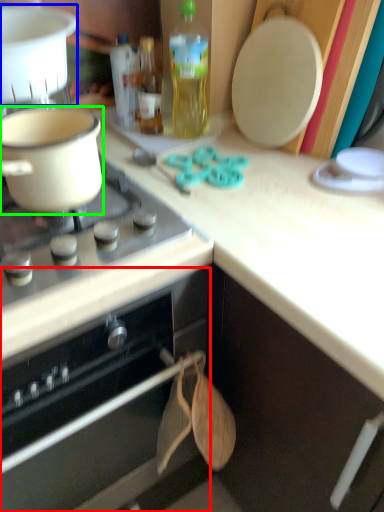
Question: Which object is positioned closest to oven (highlighted by a red box)? Select from kitchen appliance (highlighted by a blue box) and kitchen appliance (highlighted by a green box).

Choices:
 (A) kitchen appliance
 (B) kitchen appliance

Answer: (B)